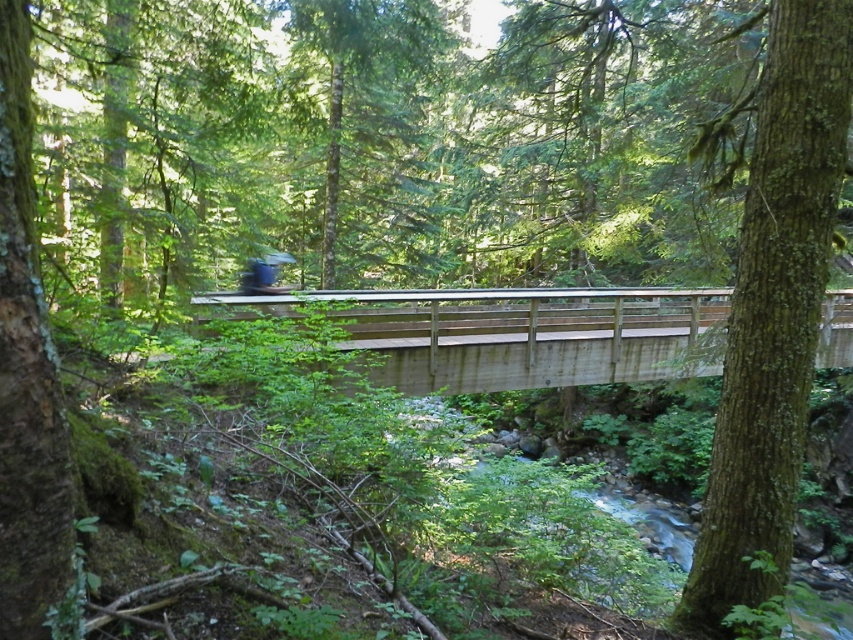
Which is more to the right, wooden bridge at center or green rough bark tree at left?

From the viewer's perspective, wooden bridge at center appears more on the right side.

How much distance is there between wooden bridge at center and green rough bark tree at left?

wooden bridge at center and green rough bark tree at left are 27.18 feet apart from each other.

I want to click on wooden bridge at center, so click(x=517, y=333).

Is green rough bark tree at center thinner than green rough bark tree at left?

No.

Does green rough bark tree at center appear on the right side of green rough bark tree at left?

Indeed, green rough bark tree at center is positioned on the right side of green rough bark tree at left.

Where is `green rough bark tree at center`? The image size is (853, 640). green rough bark tree at center is located at coordinates (775, 308).

In order to click on green rough bark tree at center in this screenshot , I will do [775, 308].

Between point (790, 42) and point (714, 323), which one is positioned behind?

Point (714, 323)

Is green rough bark tree at center above wooden bridge at center?

No.

Is point (741, 278) positioned after point (544, 308)?

No, (741, 278) is in front of (544, 308).

Image resolution: width=853 pixels, height=640 pixels. I want to click on green rough bark tree at center, so click(x=775, y=308).